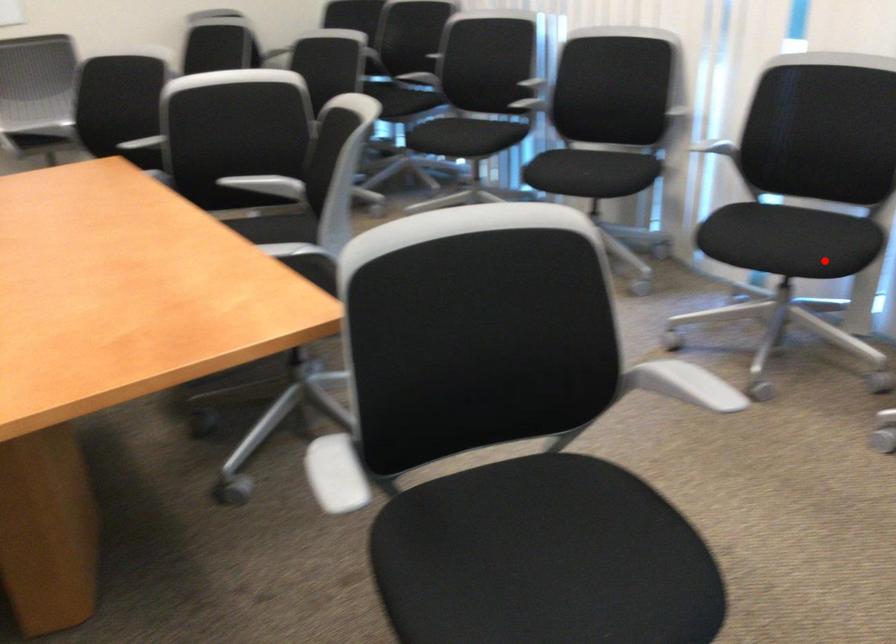
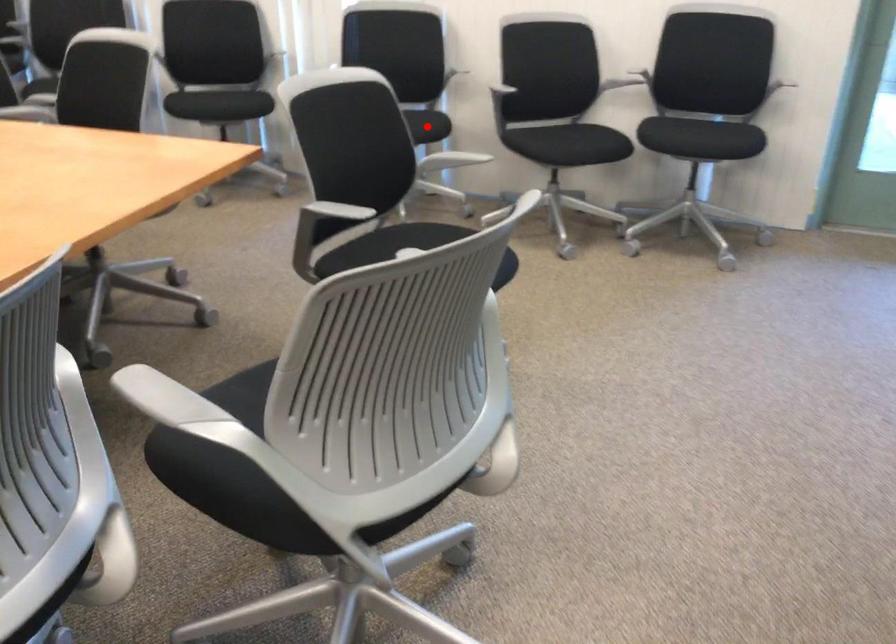
I am providing you with two images of the same scene from different viewpoints. A red point is marked on the first image and another point is marked on the second image. Is the marked point in image1 the same physical position as the marked point in image2?

Yes